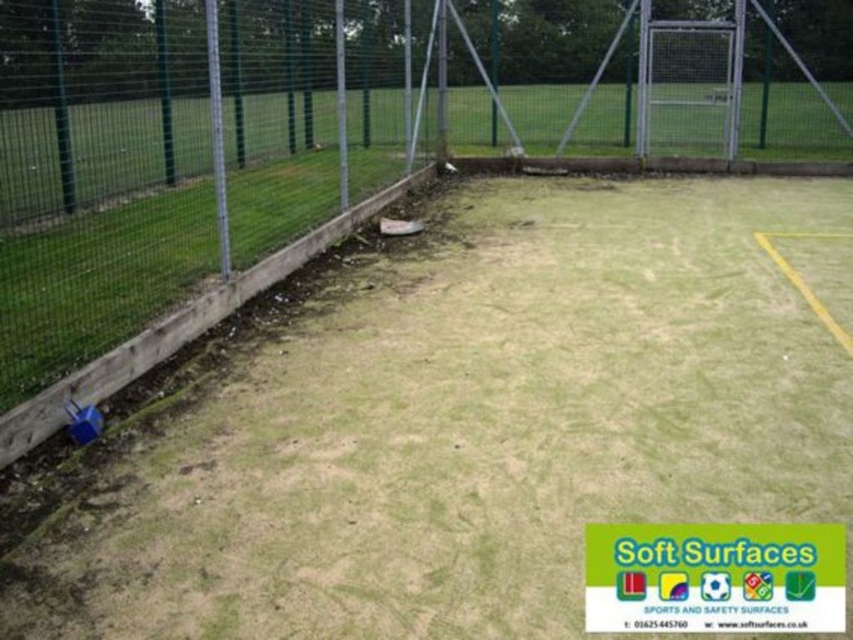
Question: Which of the following is the farthest from the observer?

Choices:
 (A) green grass at center
 (B) green wire mesh fence at upper left

Answer: (A)

Question: Is green grass at center further to the viewer compared to green wire mesh fence at upper left?

Choices:
 (A) yes
 (B) no

Answer: (A)

Question: Does green grass at center have a larger size compared to green wire mesh fence at upper left?

Choices:
 (A) no
 (B) yes

Answer: (A)

Question: Which of the following is the closest to the observer?

Choices:
 (A) (527, 145)
 (B) (701, 369)

Answer: (B)

Question: Does green grass at center appear over green wire mesh fence at upper left?

Choices:
 (A) no
 (B) yes

Answer: (A)